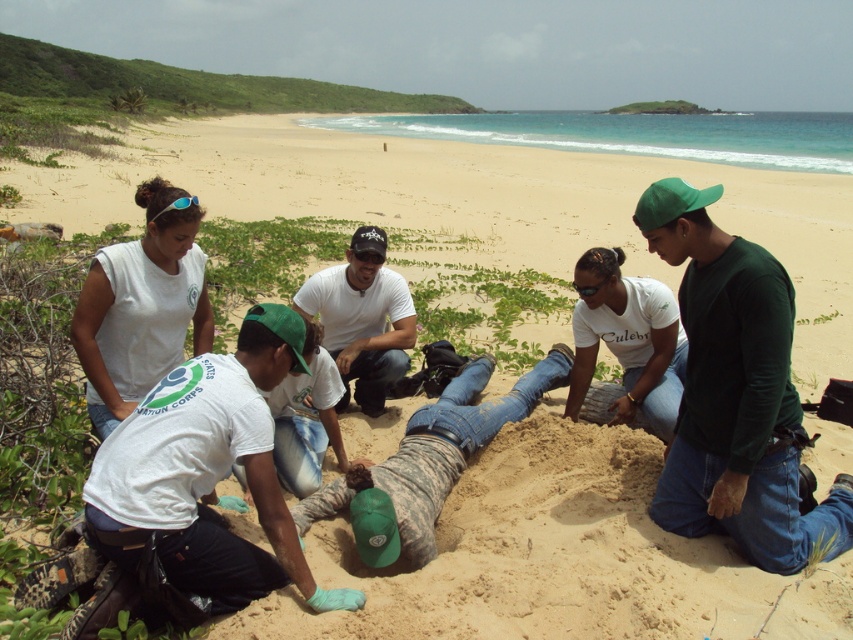
Question: Based on their relative distances, which object is farther from the green matte shirt at center?

Choices:
 (A) white matte shirt at center
 (B) white cotton shirt at lower left

Answer: (A)

Question: Does green matte shirt at center appear over white cotton shirt at lower left?

Choices:
 (A) yes
 (B) no

Answer: (A)

Question: Which object is closer to the camera taking this photo?

Choices:
 (A) green matte shirt at center
 (B) white matte shirt at center
 (C) white cotton shirt at lower left

Answer: (C)

Question: Which point is farther to the camera?

Choices:
 (A) (x=131, y=557)
 (B) (x=366, y=262)

Answer: (B)

Question: Can you confirm if green matte shirt at center is wider than white cotton shirt at lower left?

Choices:
 (A) yes
 (B) no

Answer: (A)

Question: Is green matte shirt at center smaller than white matte shirt at center?

Choices:
 (A) yes
 (B) no

Answer: (B)